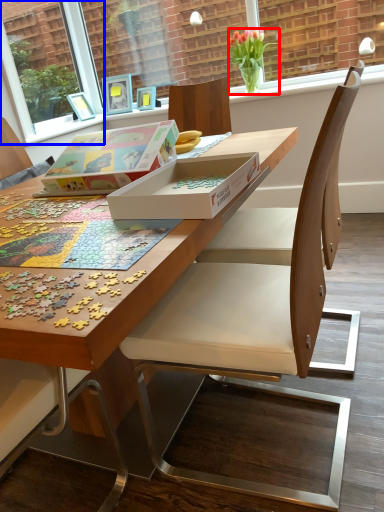
Question: Which object appears closest to the camera in this image, houseplant (highlighted by a red box) or window screen (highlighted by a blue box)?

Choices:
 (A) houseplant
 (B) window screen

Answer: (A)